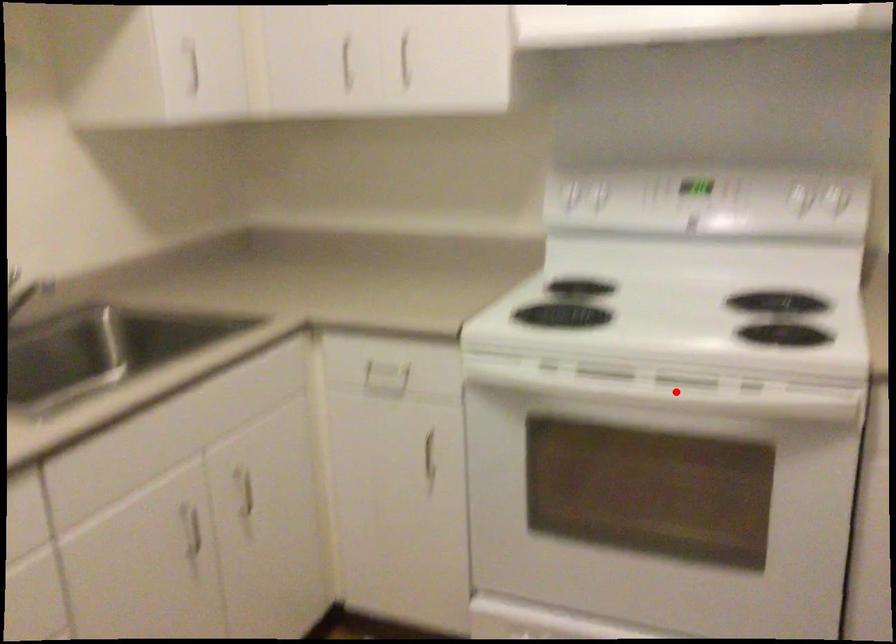
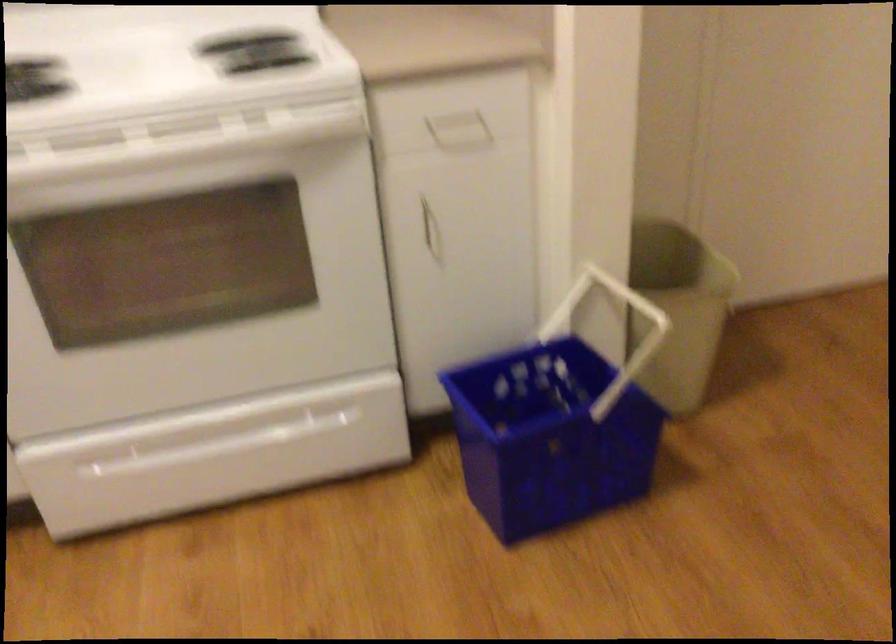
Find the pixel in the second image that matches the highlighted location in the first image.

(175, 143)